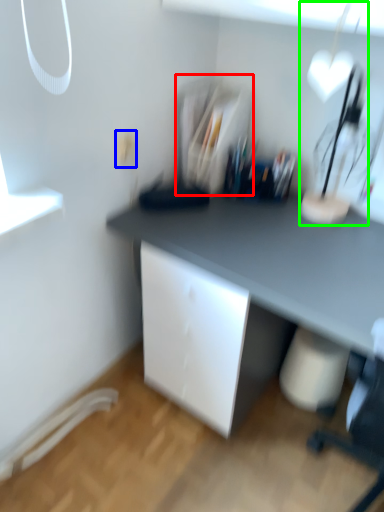
Question: Considering the real-world distances, which object is closest to shelf (highlighted by a red box)? electric outlet (highlighted by a blue box) or table lamp (highlighted by a green box).

Choices:
 (A) electric outlet
 (B) table lamp

Answer: (A)